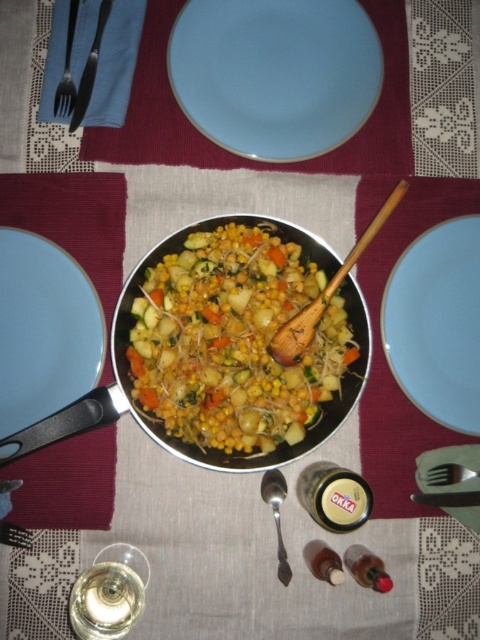
In the scene shown: Who is positioned more to the right, silver metallic frying pan at center or brushed metal spoon at lower center?

Positioned to the right is silver metallic frying pan at center.

Does point (347, 340) lie behind point (8, 524)?

No.

The width and height of the screenshot is (480, 640). I want to click on silver metallic frying pan at center, so click(225, 349).

Does clear glass wine glass at lower left have a greater width compared to brushed metal fork at lower right?

Correct, the width of clear glass wine glass at lower left exceeds that of brushed metal fork at lower right.

What do you see at coordinates (109, 593) in the screenshot?
I see `clear glass wine glass at lower left` at bounding box center [109, 593].

The height and width of the screenshot is (640, 480). Identify the location of clear glass wine glass at lower left. (109, 593).

Is light blue ceramic plate at right to the left of satin silver fork at lower right from the viewer's perspective?

Correct, you'll find light blue ceramic plate at right to the left of satin silver fork at lower right.

Is light blue ceramic plate at right further to the viewer compared to satin silver fork at lower right?

No.

Find the location of a particular element. The height and width of the screenshot is (640, 480). light blue ceramic plate at right is located at coordinates (436, 323).